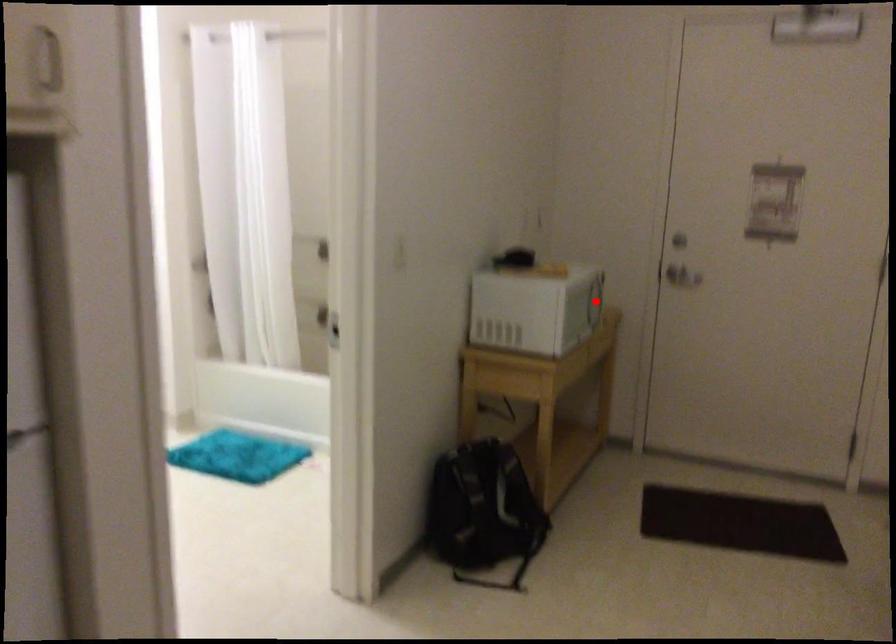
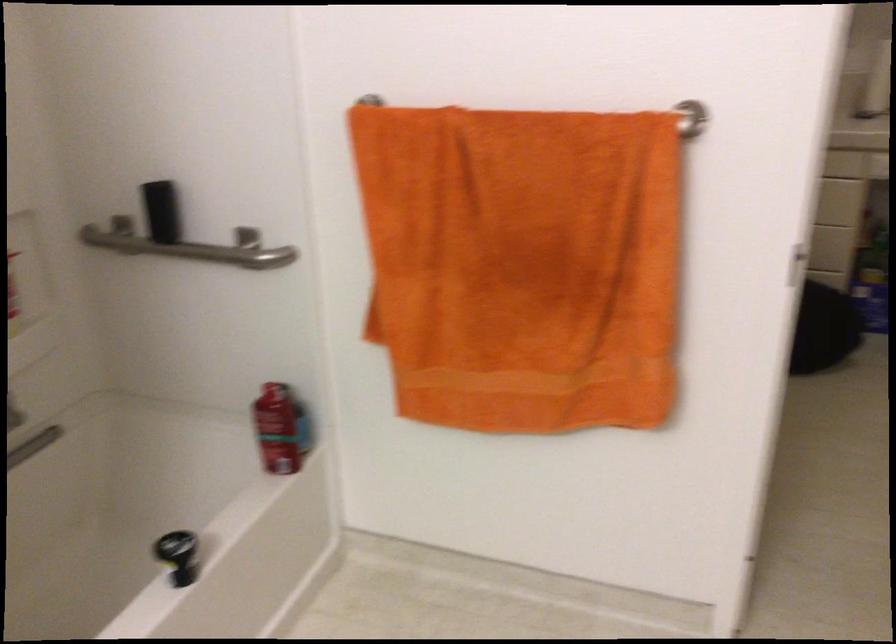
Question: I am providing you with two images of the same scene from different viewpoints. A red point is marked on the first image. At the location where the point appears in image 1, is it still visible in image 2?

Choices:
 (A) Yes
 (B) No

Answer: (B)